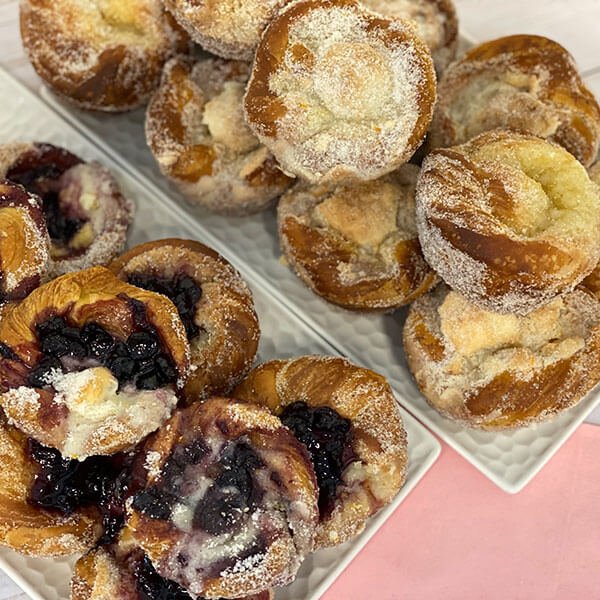
Where is `space in front of the pastries`? The height and width of the screenshot is (600, 600). space in front of the pastries is located at coordinates (497, 553).